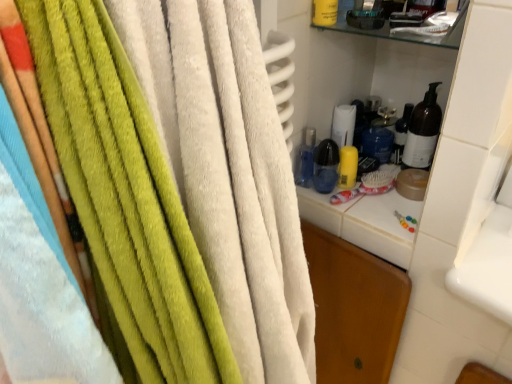
Question: From their relative heights in the image, would you say soft green towel at left is taller or shorter than transparent plastic bottle at center?

Choices:
 (A) tall
 (B) short

Answer: (A)

Question: Is soft green towel at left inside or outside of transparent plastic bottle at center?

Choices:
 (A) inside
 (B) outside

Answer: (B)

Question: Looking at their shapes, would you say soft green towel at left is wider or thinner than transparent plastic bottle at center?

Choices:
 (A) wide
 (B) thin

Answer: (A)

Question: From the image's perspective, is transparent plastic bottle at center positioned above or below soft green towel at left?

Choices:
 (A) above
 (B) below

Answer: (A)

Question: Looking at the image, does transparent plastic bottle at center seem bigger or smaller compared to soft green towel at left?

Choices:
 (A) small
 (B) big

Answer: (A)

Question: In terms of width, does transparent plastic bottle at center look wider or thinner when compared to soft green towel at left?

Choices:
 (A) wide
 (B) thin

Answer: (B)

Question: Considering the positions of point (311, 150) and point (169, 39), is point (311, 150) closer or farther from the camera than point (169, 39)?

Choices:
 (A) closer
 (B) farther

Answer: (B)